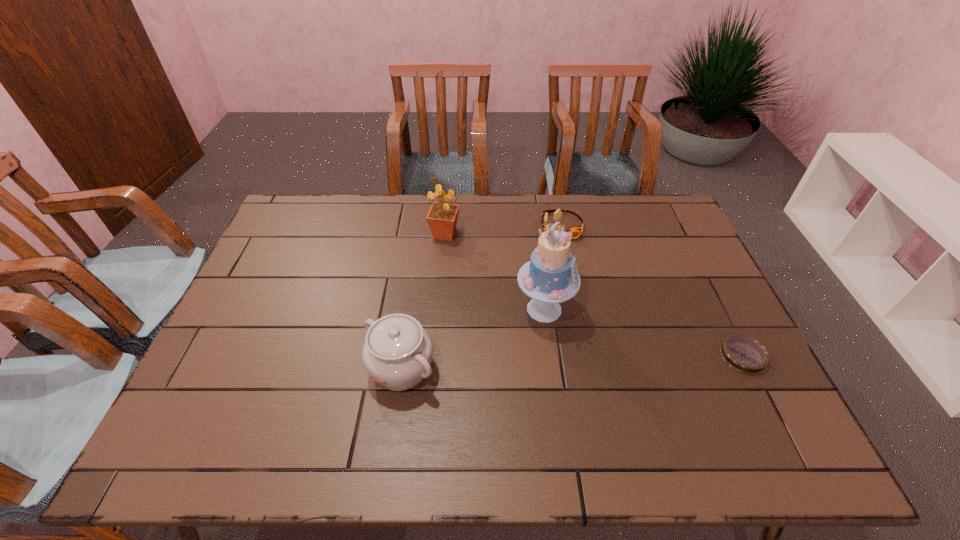
Identify the location of the third tallest object. (397, 353).

The height and width of the screenshot is (540, 960). What are the coordinates of `compass` in the screenshot? It's located at (744, 354).

Where is `the rightmost object`? The height and width of the screenshot is (540, 960). the rightmost object is located at coordinates (744, 354).

Find the location of a particular element. This screenshot has width=960, height=540. sunflower is located at coordinates (442, 217).

Locate an element on the screen. Image resolution: width=960 pixels, height=540 pixels. cake is located at coordinates pyautogui.click(x=550, y=277).

This screenshot has height=540, width=960. In order to click on the tallest object in this screenshot , I will do `click(550, 277)`.

Locate an element on the screen. the second shortest object is located at coordinates (576, 231).

Where is `blank space located 0.370m on the back of the third shortest object`? The height and width of the screenshot is (540, 960). blank space located 0.370m on the back of the third shortest object is located at coordinates (419, 249).

At what (x,y) coordinates should I click in order to perform the action: click on vacant space located on the front of the shortest object. Please return your answer as a coordinate pair (x, y). The height and width of the screenshot is (540, 960). Looking at the image, I should click on (767, 404).

The image size is (960, 540). I want to click on vacant region located at the front of the second tallest object with flowers visible, so click(511, 298).